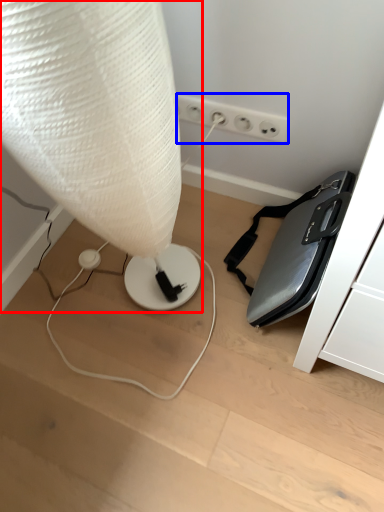
Question: Which point is further to the camera, lamp (highlighted by a red box) or electric outlet (highlighted by a blue box)?

Choices:
 (A) lamp
 (B) electric outlet

Answer: (B)